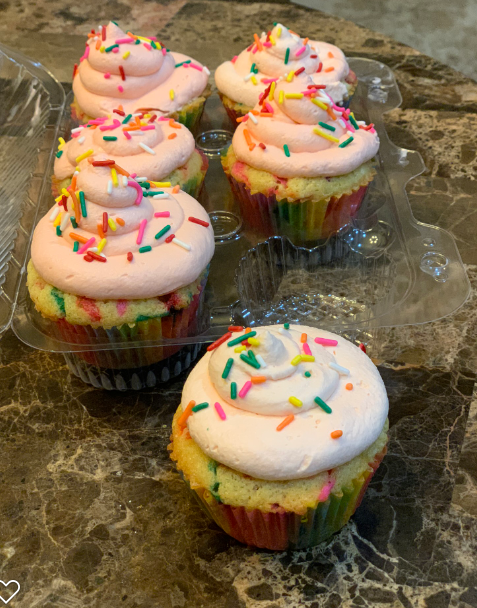
In order to click on empty cup hole in this screenshot , I will do `click(301, 301)`.